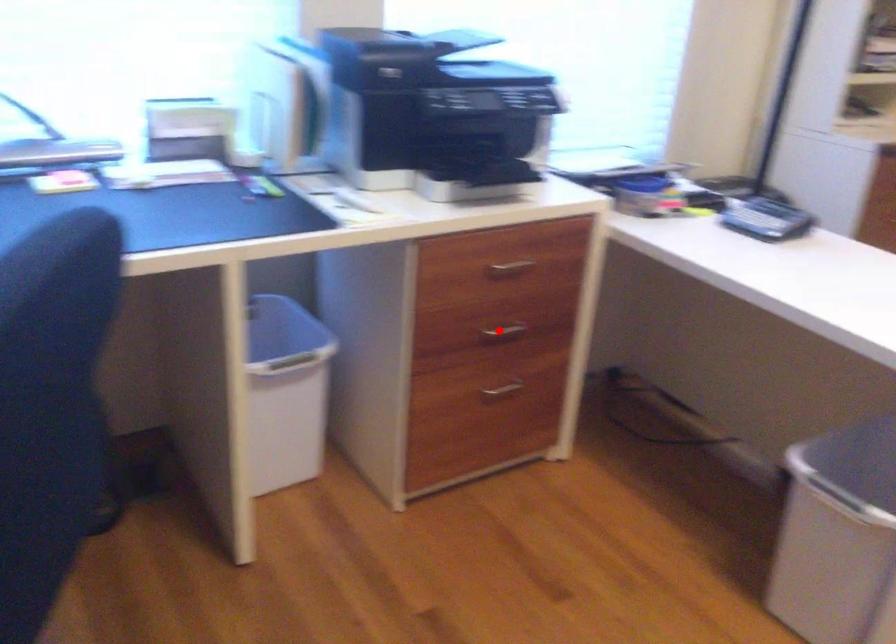
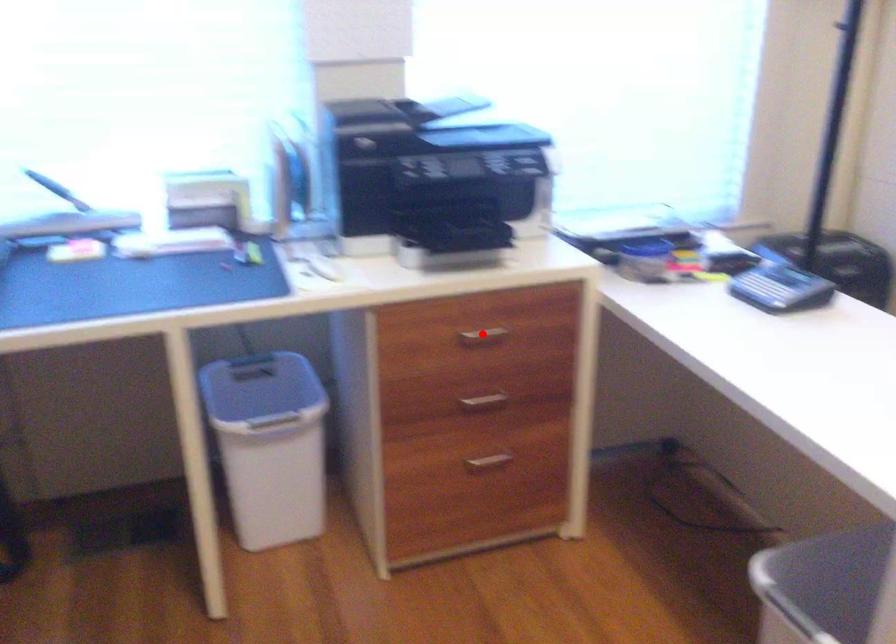
I am providing you with two images of the same scene from different viewpoints. A red point is marked on the first image and another point is marked on the second image. Are the points marked in image1 and image2 representing the same 3D position?

No